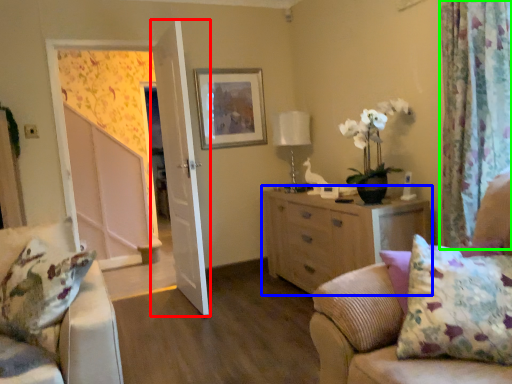
Question: Which object is positioned closest to door (highlighted by a red box)? Select from cabinetry (highlighted by a blue box) and curtain (highlighted by a green box).

Choices:
 (A) cabinetry
 (B) curtain

Answer: (A)